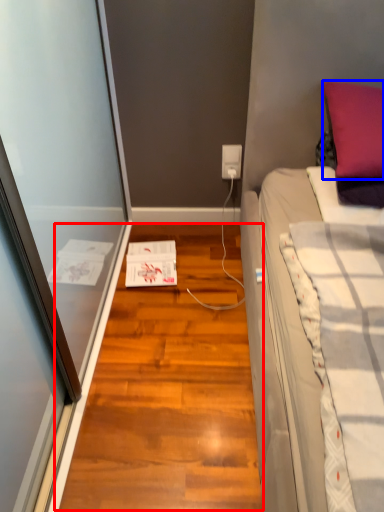
Question: Which of the following is the farthest to the observer, hardwood (highlighted by a red box) or pillow (highlighted by a blue box)?

Choices:
 (A) hardwood
 (B) pillow

Answer: (B)